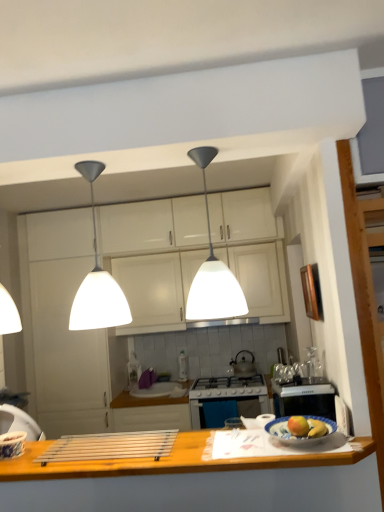
Question: Based on their sizes in the image, would you say wooden at lower center is bigger or smaller than metallic silver faucet at center?

Choices:
 (A) big
 (B) small

Answer: (A)

Question: Considering the positions of wooden at lower center and metallic silver faucet at center in the image, is wooden at lower center taller or shorter than metallic silver faucet at center?

Choices:
 (A) short
 (B) tall

Answer: (A)

Question: Estimate the real-world distances between objects in this image. Which object is farther from the wooden at lower center?

Choices:
 (A) metallic silver faucet at center
 (B) yellow matte apple at center, the 2th apple when ordered from right to left
 (C) white glossy cabinets at center, the second cabinetry when ordered from bottom to top
 (D) white matte pendant light at center, arranged as the 2th light when viewed from the right
 (E) white matte cabinet at center, which is the first cabinetry in bottom-to-top order

Answer: (A)

Question: Which object is positioned farthest from the white matte pendant light at center, marked as the 2th light in a left-to-right arrangement?

Choices:
 (A) white glossy cabinets at center, the second cabinetry when ordered from bottom to top
 (B) white matte cabinet at center, which is the first cabinetry in bottom-to-top order
 (C) wooden at lower center
 (D) matte yellow apple at center, which is the 2th apple in left-to-right order
 (E) yellow matte apple at center, the 2th apple when ordered from right to left

Answer: (A)